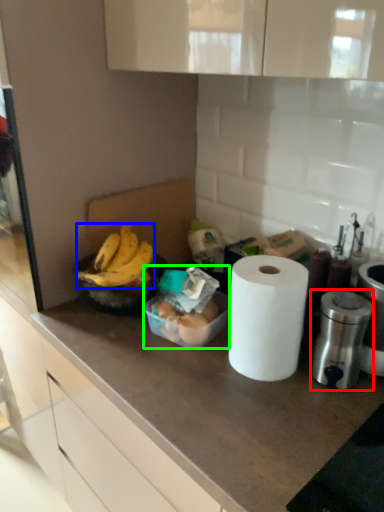
Question: Estimate the real-world distances between objects in this image. Which object is farther from appliance (highlighted by a red box), banana (highlighted by a blue box) or food (highlighted by a green box)?

Choices:
 (A) banana
 (B) food

Answer: (A)